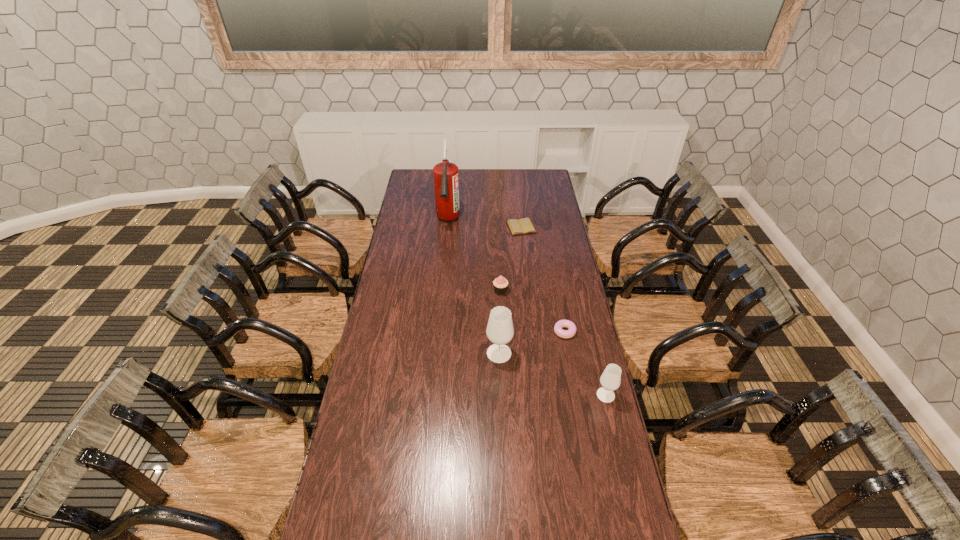
Locate an element on the screen. This screenshot has width=960, height=540. doughnut located at the right edge is located at coordinates (560, 324).

In the image, there is a desktop. At what (x,y) coordinates should I click in order to perform the action: click on vacant space at the far edge. Please return your answer as a coordinate pair (x, y). This screenshot has height=540, width=960. Looking at the image, I should click on (477, 188).

Where is `free spot at the left edge of the desktop`? This screenshot has height=540, width=960. free spot at the left edge of the desktop is located at coordinates (368, 407).

Locate an element on the screen. Image resolution: width=960 pixels, height=540 pixels. blank area at the right edge is located at coordinates (562, 269).

I want to click on free space between the fourth tallest object and the third object from right to left, so 511,259.

Where is `unoccupied area between the diary and the third tallest object`? This screenshot has height=540, width=960. unoccupied area between the diary and the third tallest object is located at coordinates (564, 311).

Image resolution: width=960 pixels, height=540 pixels. In order to click on empty space that is in between the fire extinguisher and the fifth farthest object in this screenshot , I will do `click(473, 287)`.

This screenshot has width=960, height=540. I want to click on blank region between the fire extinguisher and the second object from right to left, so click(506, 276).

You are a GUI agent. You are given a task and a screenshot of the screen. Output one action in this format:
    pyautogui.click(x=<x>, y=<y>)
    Task: Click on the vacant space that is in between the third tallest object and the third nearest object
    
    Given the screenshot: What is the action you would take?
    pyautogui.click(x=586, y=363)

You are a GUI agent. You are given a task and a screenshot of the screen. Output one action in this format:
    pyautogui.click(x=<x>, y=<y>)
    Task: Click on the blank region between the fire extinguisher and the fourth nearest object
    
    Given the screenshot: What is the action you would take?
    pyautogui.click(x=474, y=256)